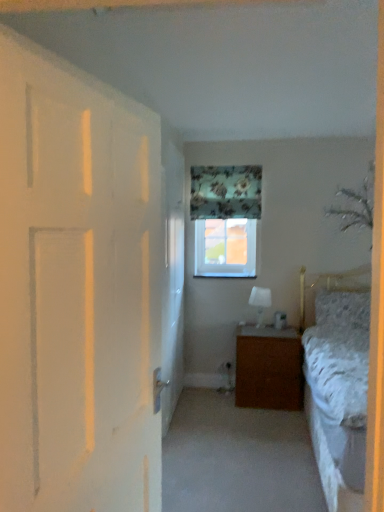
Question: Considering the positions of fluffy white pillow at right and clear glass window at upper center in the image, is fluffy white pillow at right taller or shorter than clear glass window at upper center?

Choices:
 (A) short
 (B) tall

Answer: (A)

Question: In terms of width, does fluffy white pillow at right look wider or thinner when compared to clear glass window at upper center?

Choices:
 (A) thin
 (B) wide

Answer: (B)

Question: Which object is the closest to the floral fabric curtain at upper center?

Choices:
 (A) white glossy screen door at center
 (B) clear glass window at upper center
 (C) fluffy white pillow at right
 (D) brown wooden nightstand at center
 (E) white glossy lampshade at center

Answer: (B)

Question: Considering the real-world distances, which object is closest to the fluffy white pillow at right?

Choices:
 (A) white matte door at left
 (B) brown wooden nightstand at center
 (C) white glossy screen door at center
 (D) white glossy lampshade at center
 (E) clear glass window at upper center

Answer: (B)